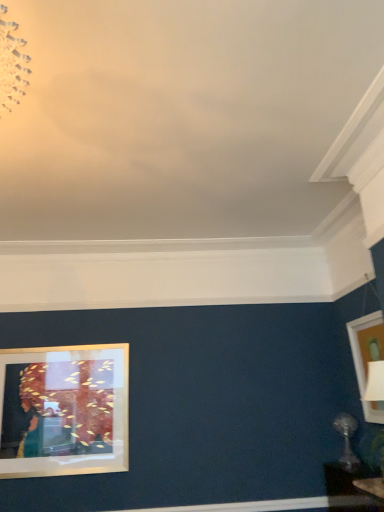
Question: From a real-world perspective, is matte black table at lower right positioned above or below matte gold picture frame at upper right?

Choices:
 (A) above
 (B) below

Answer: (B)

Question: Is matte black table at lower right inside the boundaries of matte gold picture frame at upper right, or outside?

Choices:
 (A) outside
 (B) inside

Answer: (A)

Question: Which object is positioned farthest from the satin silver table lamp at lower right?

Choices:
 (A) matte black table at lower right
 (B) matte gold picture frame at upper right

Answer: (B)

Question: Which is nearer to the satin silver table lamp at lower right?

Choices:
 (A) matte gold picture frame at upper right
 (B) matte black table at lower right

Answer: (B)